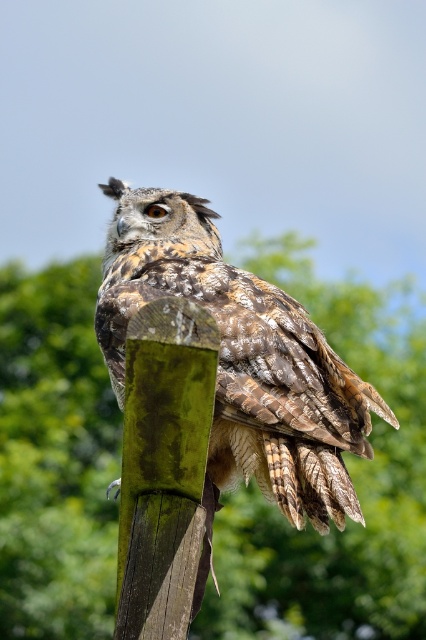
You are a birdwatcher observing the scene. The camouflage feathered owl at center is perched on the green mossy post at center. Which object is taller in this scene?

The camouflage feathered owl at center is taller than the green mossy post at center.

Based on the scene, which object takes up more area in the image? Please choose between the green mossy post at center and the camouflage feathered owl at center.

The camouflage feathered owl at center takes up more area in the image than the green mossy post at center, as stated in the description.

You are a birdwatcher trying to observe the camouflage feathered owl at center. The green mossy post at center is in your line of sight. Can you see the owl clearly through the post?

The green mossy post at center is above the camouflage feathered owl at center, so the owl is partially hidden beneath the post. This makes it difficult to see the owl clearly through the post.